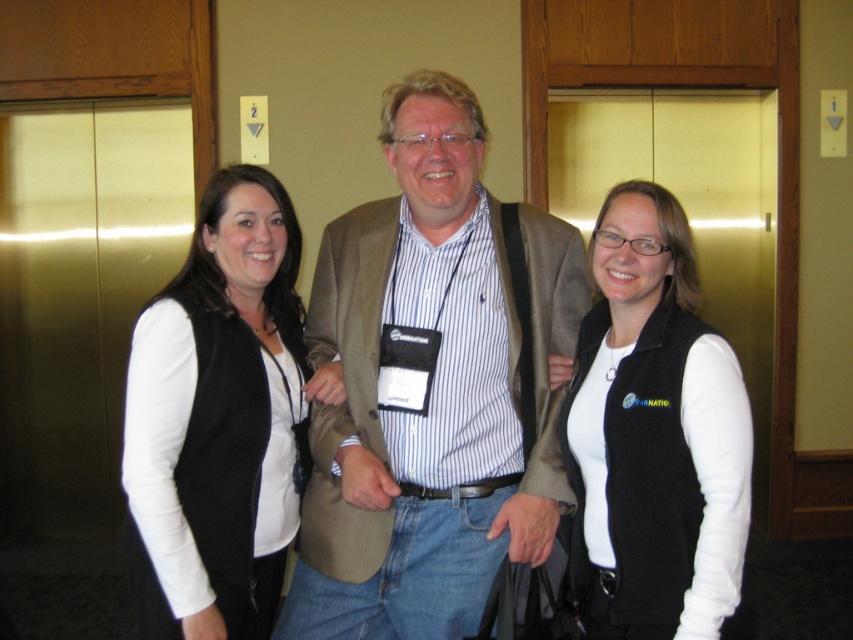
Question: Among these points, which one is farthest from the camera?

Choices:
 (A) (610, 305)
 (B) (544, 532)
 (C) (224, 442)

Answer: (A)

Question: Is striped cotton shirt at center smaller than black fleece vest at left?

Choices:
 (A) yes
 (B) no

Answer: (B)

Question: Which object is positioned closest to the striped cotton shirt at center?

Choices:
 (A) black fleece vest at right
 (B) black fleece vest at left

Answer: (B)

Question: Observing the image, what is the correct spatial positioning of black fleece vest at left in reference to black fleece vest at right?

Choices:
 (A) below
 (B) above

Answer: (B)

Question: Considering the relative positions of striped cotton shirt at center and black fleece vest at right in the image provided, where is striped cotton shirt at center located with respect to black fleece vest at right?

Choices:
 (A) right
 (B) left

Answer: (B)

Question: Which object is closer to the camera taking this photo?

Choices:
 (A) black fleece vest at right
 (B) striped cotton shirt at center
 (C) black fleece vest at left

Answer: (A)